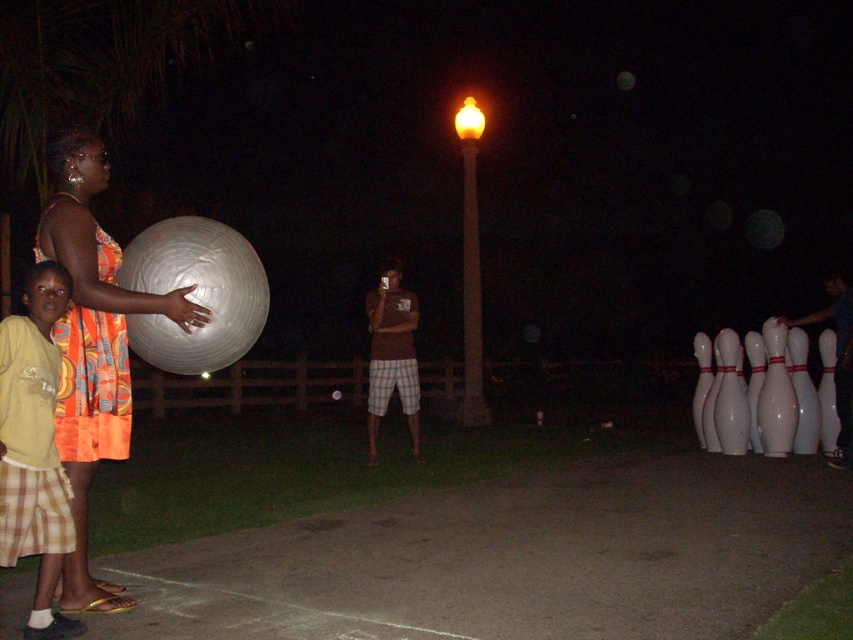
The height and width of the screenshot is (640, 853). What do you see at coordinates (91, 346) in the screenshot?
I see `orange printed dress at left` at bounding box center [91, 346].

Does orange printed dress at left appear on the left side of orange printed fabric dress at left?

No, orange printed dress at left is not to the left of orange printed fabric dress at left.

What do you see at coordinates (91, 346) in the screenshot? This screenshot has height=640, width=853. I see `orange printed dress at left` at bounding box center [91, 346].

Where is `orange printed dress at left`? The height and width of the screenshot is (640, 853). orange printed dress at left is located at coordinates (91, 346).

Can you confirm if orange printed dress at left is positioned to the right of yellow cotton shirt at left?

Correct, you'll find orange printed dress at left to the right of yellow cotton shirt at left.

Between point (128, 394) and point (19, 486), which one is positioned in front?

Point (19, 486) is in front.

The image size is (853, 640). Describe the element at coordinates (91, 346) in the screenshot. I see `orange printed dress at left` at that location.

The height and width of the screenshot is (640, 853). In order to click on orange printed dress at left in this screenshot , I will do `click(91, 346)`.

Who is positioned more to the right, yellow cotton shirt at left or orange printed fabric dress at left?

orange printed fabric dress at left is more to the right.

I want to click on yellow cotton shirt at left, so click(x=33, y=448).